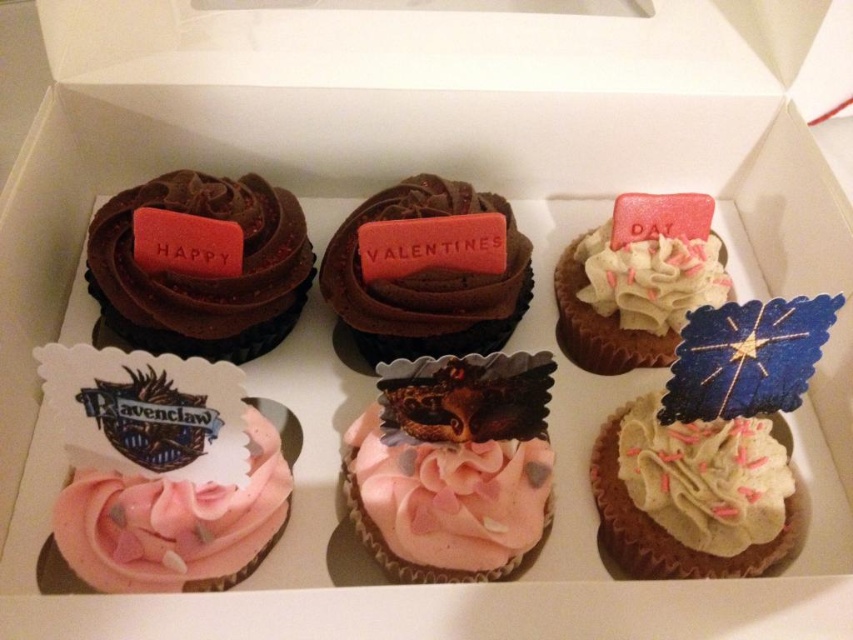
Question: Among these objects, which one is nearest to the camera?

Choices:
 (A) chocolatesmoothcupcake at center
 (B) pink buttercream at center
 (C) creamy vanilla cupcake at center-right

Answer: (B)

Question: Which point appears farthest from the camera in this image?

Choices:
 (A) (734, 524)
 (B) (616, 204)
 (C) (485, 529)

Answer: (B)

Question: Which point appears farthest from the camera in this image?

Choices:
 (A) (598, 532)
 (B) (543, 506)

Answer: (A)

Question: Does chocolate matte at upper left appear on the right side of pink buttercream at center?

Choices:
 (A) no
 (B) yes

Answer: (A)

Question: Does pink buttercream at center appear over chocolatesmoothcupcake at center?

Choices:
 (A) yes
 (B) no

Answer: (B)

Question: Does creamy vanilla cupcake at center-right appear on the right side of pink buttercream at center?

Choices:
 (A) yes
 (B) no

Answer: (A)